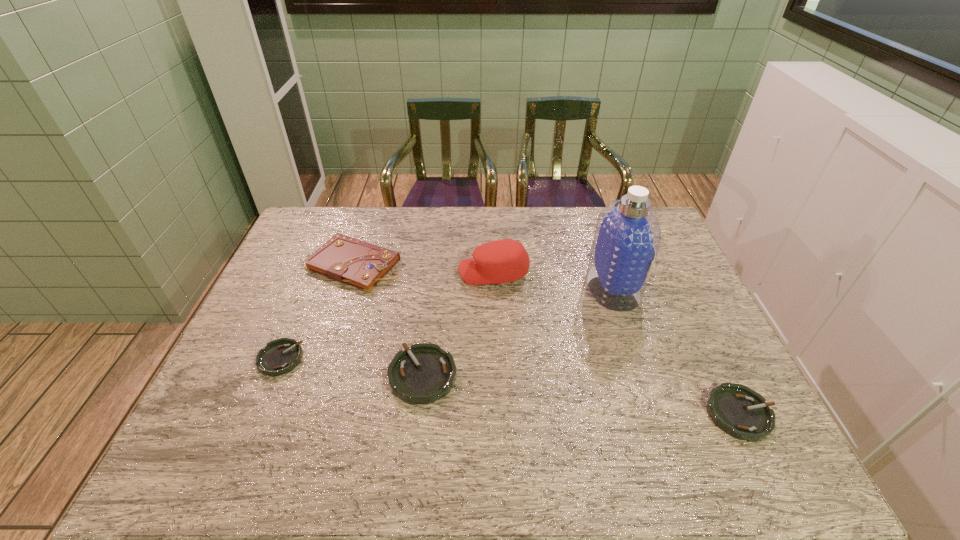
At what (x,y) coordinates should I click in order to perform the action: click on free space located on the left of the shortest object. Please return your answer as a coordinate pair (x, y). The height and width of the screenshot is (540, 960). Looking at the image, I should click on (239, 359).

Locate an element on the screen. vacant area located 0.160m on the back of the fourth tallest object is located at coordinates (431, 306).

You are a GUI agent. You are given a task and a screenshot of the screen. Output one action in this format:
    pyautogui.click(x=<x>, y=<y>)
    Task: Click on the free location located on the left of the second shortest ashtray
    The width and height of the screenshot is (960, 540).
    Given the screenshot: What is the action you would take?
    pyautogui.click(x=566, y=414)

What are the coordinates of `blank area located on the left of the cleansing agent` in the screenshot? It's located at (566, 287).

This screenshot has height=540, width=960. What are the coordinates of `vacant space situated on the front-facing side of the cap` in the screenshot? It's located at (420, 272).

Image resolution: width=960 pixels, height=540 pixels. I want to click on vacant space located on the front-facing side of the cap, so click(x=414, y=272).

This screenshot has width=960, height=540. What are the coordinates of `vacant position located on the front-facing side of the cap` in the screenshot? It's located at (398, 272).

The height and width of the screenshot is (540, 960). I want to click on vacant space located 0.250m on the right of the fourth shortest object, so click(x=480, y=265).

What are the coordinates of `object positioned at the far edge` in the screenshot? It's located at (347, 260).

Image resolution: width=960 pixels, height=540 pixels. In order to click on ashtray that is at the left edge in this screenshot , I will do `click(280, 356)`.